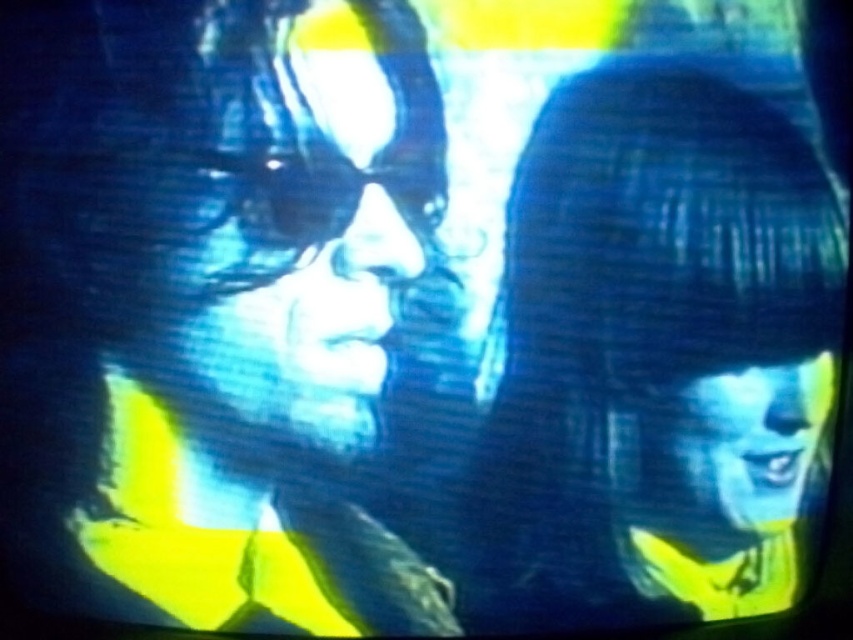
Question: Among these objects, which one is farthest from the camera?

Choices:
 (A) blue matte face at lower right
 (B) matte black hair at right
 (C) matte black goggles at center
 (D) matte blue face at left

Answer: (A)

Question: Which object is farther from the camera taking this photo?

Choices:
 (A) matte blue face at left
 (B) matte black hair at right
 (C) matte black goggles at center

Answer: (C)

Question: Estimate the real-world distances between objects in this image. Which object is closer to the matte blue face at left?

Choices:
 (A) matte black hair at right
 (B) matte black goggles at center
 (C) blue matte face at lower right

Answer: (B)

Question: In this image, where is matte black hair at right located relative to blue matte face at lower right?

Choices:
 (A) below
 (B) above

Answer: (B)

Question: Can you confirm if matte black hair at right is bigger than blue matte face at lower right?

Choices:
 (A) no
 (B) yes

Answer: (B)

Question: Can you confirm if blue matte face at lower right is positioned to the left of matte black goggles at center?

Choices:
 (A) no
 (B) yes

Answer: (A)